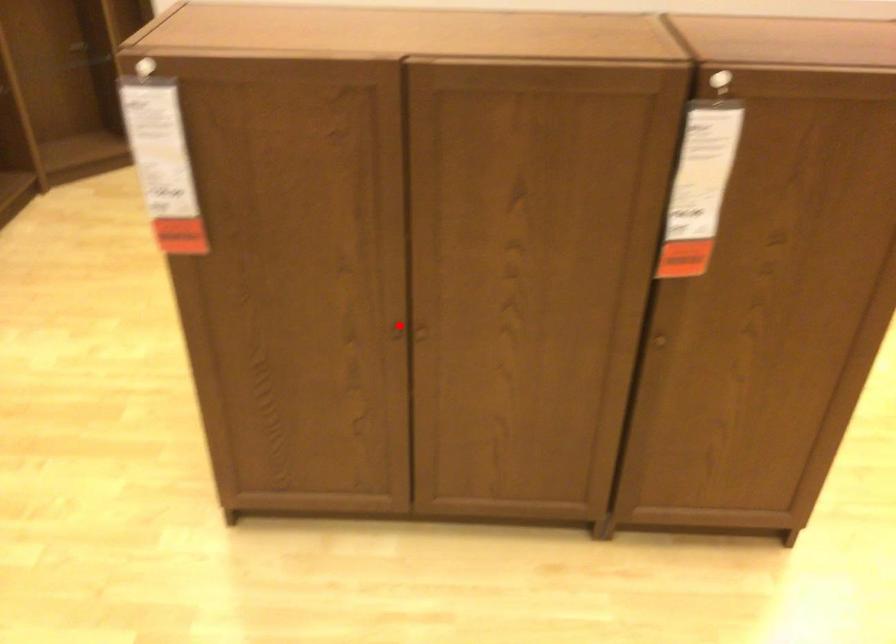
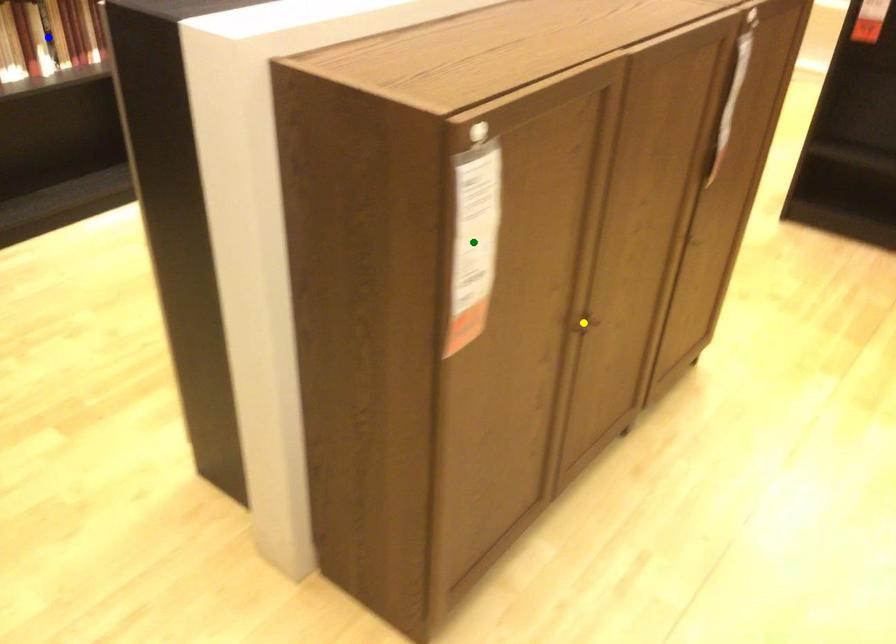
Question: I am providing you with two images of the same scene from different viewpoints. A red point is marked on the first image. You are given multiple points on the second image. Which spot in image 2 lines up with the point in image 1?

Choices:
 (A) green point
 (B) yellow point
 (C) blue point

Answer: (B)